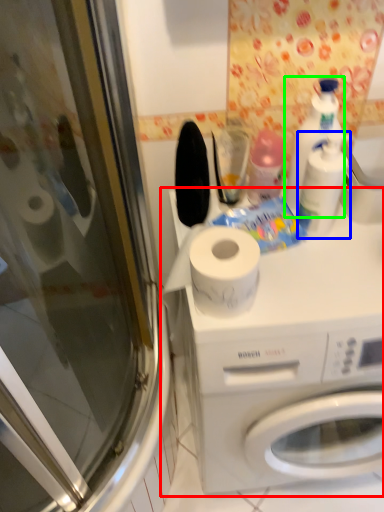
Question: Considering the real-world distances, which object is closest to washing machine (highlighted by a red box)? cleaning product (highlighted by a blue box) or cleaning product (highlighted by a green box).

Choices:
 (A) cleaning product
 (B) cleaning product

Answer: (A)